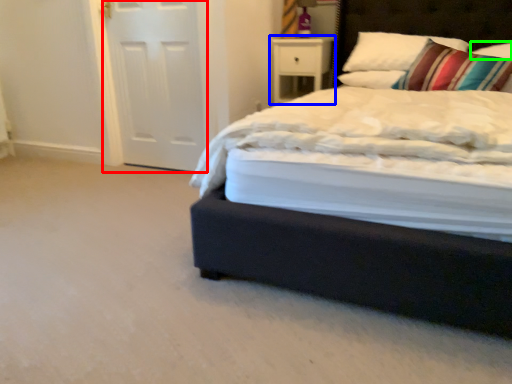
Question: Estimate the real-world distances between objects in this image. Which object is closer to screen door (highlighted by a red box), nightstand (highlighted by a blue box) or pillow (highlighted by a green box)?

Choices:
 (A) nightstand
 (B) pillow

Answer: (A)